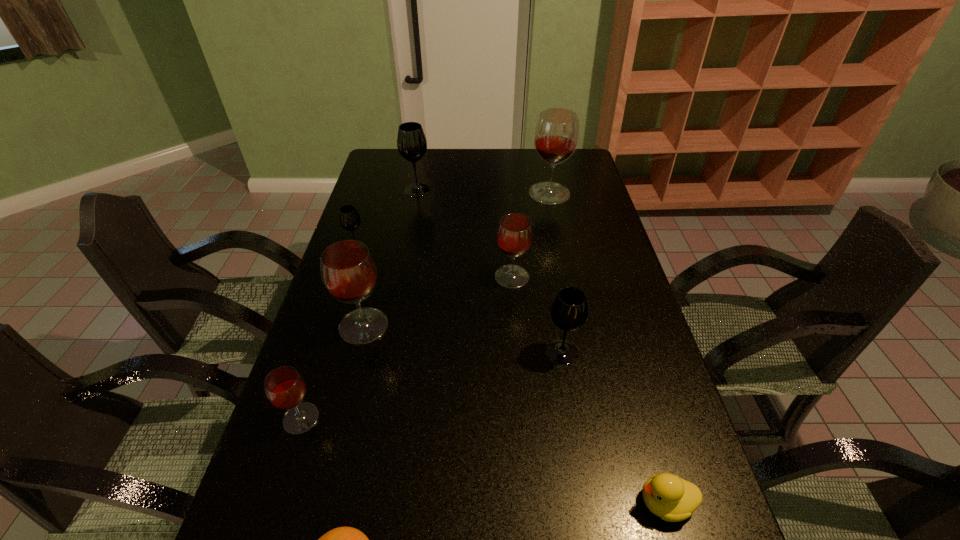
You are a GUI agent. You are given a task and a screenshot of the screen. Output one action in this format:
    pyautogui.click(x=<x>, y=<y>)
    Task: Click on the free space located on the right of the smallest gray wineglass
    
    Given the screenshot: What is the action you would take?
    pyautogui.click(x=443, y=248)

This screenshot has height=540, width=960. I want to click on vacant space located 0.170m on the front of the seventh farthest object, so click(269, 518).

The height and width of the screenshot is (540, 960). What are the coordinates of `vacant space located on the beak of the yellow duckling` in the screenshot? It's located at (529, 503).

The width and height of the screenshot is (960, 540). In order to click on vacant region located 0.120m on the beak of the yellow duckling in this screenshot , I will do `click(575, 503)`.

You are a GUI agent. You are given a task and a screenshot of the screen. Output one action in this format:
    pyautogui.click(x=<x>, y=<y>)
    Task: Click on the vacant space situated on the beak of the yellow duckling
    The image size is (960, 540).
    Given the screenshot: What is the action you would take?
    pyautogui.click(x=540, y=503)

At what (x,y) coordinates should I click in order to perform the action: click on wineglass that is at the right edge. Please return your answer as a coordinate pair (x, y). Looking at the image, I should click on coord(556,136).

This screenshot has height=540, width=960. I want to click on duckling that is at the right edge, so click(x=673, y=499).

Image resolution: width=960 pixels, height=540 pixels. I want to click on free space at the left edge of the desktop, so click(x=394, y=181).

At what (x,y) coordinates should I click in order to perform the action: click on vacant area at the right edge of the desktop. Please return your answer as a coordinate pair (x, y). The height and width of the screenshot is (540, 960). Looking at the image, I should click on (596, 259).

The width and height of the screenshot is (960, 540). In the image, there is a desktop. Identify the location of free space at the far left corner. (380, 159).